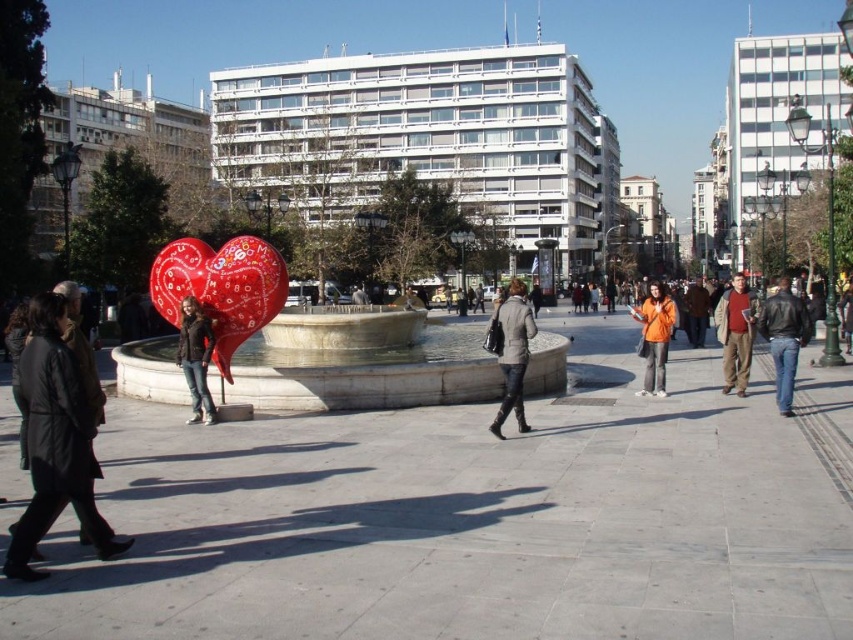
Is white marble fountain at center to the right of gray wool coat at center from the viewer's perspective?

In fact, white marble fountain at center is to the left of gray wool coat at center.

Is point (341, 310) in front of point (514, 358)?

No, it is behind (514, 358).

Does point (209, 266) come farther from viewer compared to point (508, 323)?

Yes, it is behind point (508, 323).

Image resolution: width=853 pixels, height=640 pixels. What are the coordinates of `white marble fountain at center` in the screenshot? It's located at (314, 348).

Which of these two, dark brown leather jacket at center or orange fleece jacket at center, stands shorter?

dark brown leather jacket at center

Is dark brown leather jacket at center further to camera compared to orange fleece jacket at center?

No, dark brown leather jacket at center is in front of orange fleece jacket at center.

Describe the element at coordinates (195, 358) in the screenshot. This screenshot has height=640, width=853. I see `dark brown leather jacket at center` at that location.

Locate an element on the screen. This screenshot has width=853, height=640. dark brown leather jacket at center is located at coordinates (195, 358).

Who is positioned more to the right, gray wool coat at center or dark brown leather jacket at center?

gray wool coat at center is more to the right.

Who is more forward, (523,353) or (202,337)?

Positioned in front is point (523,353).

The image size is (853, 640). What do you see at coordinates (511, 352) in the screenshot?
I see `gray wool coat at center` at bounding box center [511, 352].

Where is `gray wool coat at center`? This screenshot has height=640, width=853. gray wool coat at center is located at coordinates (511, 352).